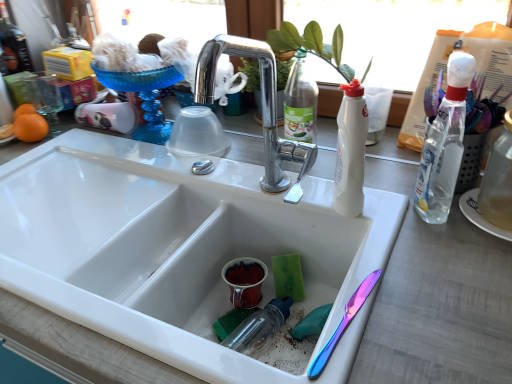
Describe the element at coordinates (444, 144) in the screenshot. I see `clear plastic bottle at right, the second bottle when ordered from right to left` at that location.

Where is `white matte bottle at center, which appears as the 1th bottle when viewed from the left`? The image size is (512, 384). white matte bottle at center, which appears as the 1th bottle when viewed from the left is located at coordinates (350, 151).

Identify the location of iridescent metallic knife at lower right. This screenshot has width=512, height=384. (344, 323).

This screenshot has width=512, height=384. I want to click on white glossy sink at center, so click(x=170, y=244).

The image size is (512, 384). What are the coordinates of `clear plastic bottle at right, the second bottle when ordered from right to left` in the screenshot? It's located at (444, 144).

From the image's perspective, who appears lower, clear plastic bottle at right, the second bottle when ordered from right to left, or white glossy sink at center?

white glossy sink at center is shown below in the image.

How different are the orientations of clear plastic bottle at right, the second bottle when ordered from right to left, and white glossy sink at center in degrees?

The angular difference between clear plastic bottle at right, the second bottle when ordered from right to left, and white glossy sink at center is 69.6 degrees.

Is white glossy sink at center completely or partially inside clear plastic bottle at right, the 2th bottle from the left?

No, white glossy sink at center is not inside clear plastic bottle at right, the 2th bottle from the left.

Considering the points (449, 107) and (251, 198), which point is in front, point (449, 107) or point (251, 198)?

The point (449, 107) is closer.

Does clear plastic bottle at right, the 2th bottle from the left, appear on the right side of iridescent metallic knife at lower right?

Yes, clear plastic bottle at right, the 2th bottle from the left, is to the right of iridescent metallic knife at lower right.

Is clear plastic bottle at right, the second bottle when ordered from right to left, behind iridescent metallic knife at lower right?

Yes, clear plastic bottle at right, the second bottle when ordered from right to left, is behind iridescent metallic knife at lower right.

Is clear plastic bottle at right, the second bottle when ordered from right to left, not inside iridescent metallic knife at lower right?

Yes, clear plastic bottle at right, the second bottle when ordered from right to left, is not within iridescent metallic knife at lower right.

Can you tell me how much clear plastic bottle at right, the second bottle when ordered from right to left, and white matte bottle at center, which appears as the 1th bottle when viewed from the left, differ in facing direction?

The angular difference between clear plastic bottle at right, the second bottle when ordered from right to left, and white matte bottle at center, which appears as the 1th bottle when viewed from the left, is 70.4 degrees.

From a real-world perspective, is clear plastic bottle at right, the 2th bottle from the left, physically located above or below white matte bottle at center, which appears as the 1th bottle when viewed from the left?

Clearly, from a real-world perspective, clear plastic bottle at right, the 2th bottle from the left, is above white matte bottle at center, which appears as the 1th bottle when viewed from the left.

Is clear plastic bottle at right, the second bottle when ordered from right to left, wider or thinner than white matte bottle at center, which appears as the 1th bottle when viewed from the left?

Considering their sizes, clear plastic bottle at right, the second bottle when ordered from right to left, looks slimmer than white matte bottle at center, which appears as the 1th bottle when viewed from the left.

From the image's perspective, is clear plastic bottle at right, the second bottle when ordered from right to left, positioned above or below white matte bottle at center, the 3th bottle positioned from the right?

Based on their image positions, clear plastic bottle at right, the second bottle when ordered from right to left, is located above white matte bottle at center, the 3th bottle positioned from the right.

At what (x,y) coordinates should I click in order to perform the action: click on the 2nd bottle in front of the green leafy plant at upper center, starting your count from the anchor. Please return your answer as a coordinate pair (x, y). Looking at the image, I should click on (444, 144).

Which is less distant, (282, 34) or (442, 112)?

The point (442, 112) is closer.

From the image's perspective, which is below, green leafy plant at upper center or clear plastic bottle at right, the 2th bottle from the left?

clear plastic bottle at right, the 2th bottle from the left, appears lower in the image.

Is green leafy plant at upper center surrounding clear plastic bottle at right, the second bottle when ordered from right to left?

That's incorrect, clear plastic bottle at right, the second bottle when ordered from right to left, is not inside green leafy plant at upper center.

In the image, there is a green leafy plant at upper center. Where is `orange below it (from a real-world perspective)`? orange below it (from a real-world perspective) is located at coordinates (30, 127).

Is orange matte at left facing away from green leafy plant at upper center?

orange matte at left is not turned away from green leafy plant at upper center.

Is orange matte at left inside or outside of green leafy plant at upper center?

orange matte at left cannot be found inside green leafy plant at upper center.

From the image's perspective, which is below, green leafy plant at upper center or orange matte at left?

orange matte at left is shown below in the image.

From the picture: Would you say orange matte at left is part of green leafy plant at upper center's contents?

Actually, orange matte at left is outside green leafy plant at upper center.

Measure the distance from green leafy plant at upper center to orange matte at left.

A distance of 28.19 inches exists between green leafy plant at upper center and orange matte at left.

Considering their positions, is green leafy plant at upper center located in front of or behind orange matte at left?

In the image, green leafy plant at upper center appears in front of orange matte at left.

Which point is more forward, (7, 171) or (490, 210)?

The point (490, 210) is closer.

Which of these two, white glossy sink at center or clear glass bottle at right, which ranks as the third bottle in left-to-right order, is wider?

white glossy sink at center is wider.

From the image's perspective, is white glossy sink at center on top of clear glass bottle at right, positioned as the first bottle in right-to-left order?

Incorrect, from the image's perspective, white glossy sink at center is lower than clear glass bottle at right, positioned as the first bottle in right-to-left order.

Who is shorter, white glossy sink at center or clear glass bottle at right, which ranks as the third bottle in left-to-right order?

Standing shorter between the two is clear glass bottle at right, which ranks as the third bottle in left-to-right order.

From the white glossy sink at center, count 2nd bottles backward and point to it. Please provide its 2D coordinates.

[(444, 144)]

In the image, there is a clear plastic bottle at right, the 2th bottle from the left. Identify the location of silverware below it (from the image's perspective). (344, 323).

From the image, which object appears to be nearer to iridescent metallic knife at lower right, white matte bottle at center, which appears as the 1th bottle when viewed from the left, or clear plastic bottle at right, the 2th bottle from the left?

white matte bottle at center, which appears as the 1th bottle when viewed from the left, is closer to iridescent metallic knife at lower right.

Which object lies nearer to the anchor point clear glass bottle at right, positioned as the first bottle in right-to-left order, white glossy sink at center or green leafy plant at upper center?

Among the two, green leafy plant at upper center is located nearer to clear glass bottle at right, positioned as the first bottle in right-to-left order.

When comparing their distances from iridescent metallic knife at lower right, does green leafy plant at upper center or clear glass bottle at right, which ranks as the third bottle in left-to-right order, seem further?

Based on the image, green leafy plant at upper center appears to be further to iridescent metallic knife at lower right.

Looking at the image, which one is located closer to white matte bottle at center, the 3th bottle positioned from the right, clear glass bottle at right, which ranks as the third bottle in left-to-right order, or clear plastic bottle at right, the second bottle when ordered from right to left?

The object closer to white matte bottle at center, the 3th bottle positioned from the right, is clear plastic bottle at right, the second bottle when ordered from right to left.

Based on their spatial positions, is clear plastic bottle at right, the 2th bottle from the left, or iridescent metallic knife at lower right closer to orange matte at left?

Among the two, iridescent metallic knife at lower right is located nearer to orange matte at left.

From the image, which object appears to be farther from iridescent metallic knife at lower right, green leafy plant at upper center or white matte bottle at center, the 3th bottle positioned from the right?

Based on the image, green leafy plant at upper center appears to be further to iridescent metallic knife at lower right.

Which object lies further to the anchor point white matte bottle at center, the 3th bottle positioned from the right, orange matte at left or clear plastic bottle at right, the second bottle when ordered from right to left?

orange matte at left is further to white matte bottle at center, the 3th bottle positioned from the right.

Estimate the real-world distances between objects in this image. Which object is closer to green leafy plant at upper center, iridescent metallic knife at lower right or orange matte at left?

iridescent metallic knife at lower right is closer to green leafy plant at upper center.

Find the location of a particular element. This screenshot has width=512, height=384. silverware between orange matte at left and white matte bottle at center, which appears as the 1th bottle when viewed from the left is located at coordinates (344, 323).

Where is `bottle between white matte bottle at center, which appears as the 1th bottle when viewed from the left, and clear glass bottle at right, positioned as the first bottle in right-to-left order, in the horizontal direction`? Image resolution: width=512 pixels, height=384 pixels. bottle between white matte bottle at center, which appears as the 1th bottle when viewed from the left, and clear glass bottle at right, positioned as the first bottle in right-to-left order, in the horizontal direction is located at coordinates (444, 144).

The height and width of the screenshot is (384, 512). Identify the location of silverware located between orange matte at left and clear glass bottle at right, positioned as the first bottle in right-to-left order, in the left-right direction. (344, 323).

Find the location of a particular element. silverware between orange matte at left and green leafy plant at upper center from left to right is located at coordinates (344, 323).